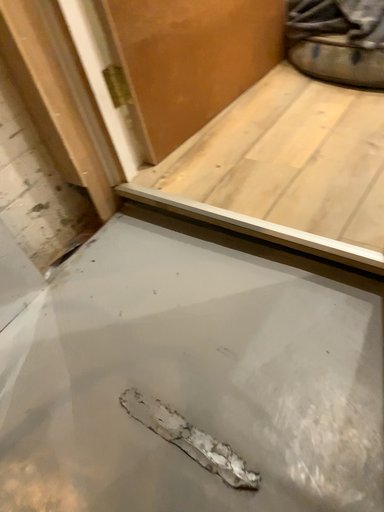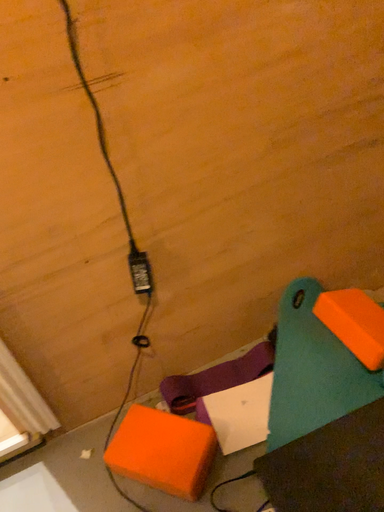
Question: How did the camera likely rotate when shooting the video?

Choices:
 (A) rotated left
 (B) rotated right

Answer: (B)